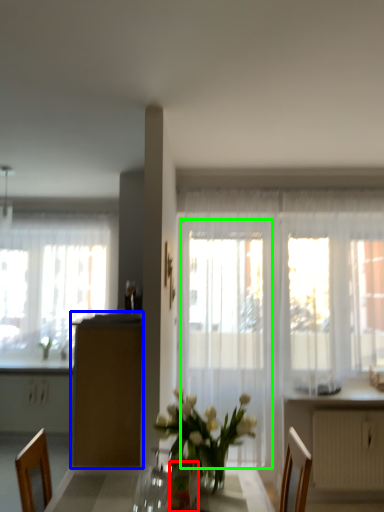
Question: Which object is positioned closest to vase (highlighted by a red box)? Select from cabinetry (highlighted by a blue box) and screen door (highlighted by a green box).

Choices:
 (A) cabinetry
 (B) screen door

Answer: (A)